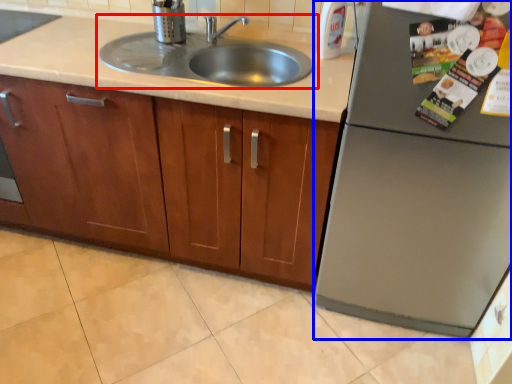
Question: Among these objects, which one is farthest to the camera, sink (highlighted by a red box) or appliance (highlighted by a blue box)?

Choices:
 (A) sink
 (B) appliance

Answer: (A)